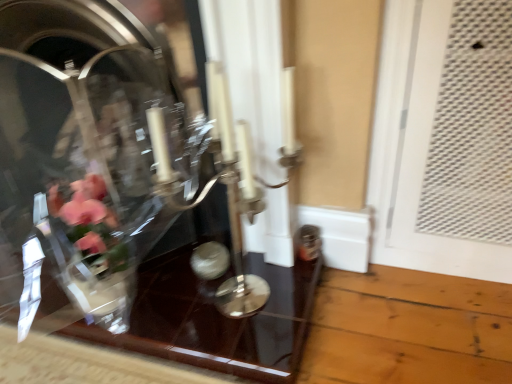
Image resolution: width=512 pixels, height=384 pixels. Describe the element at coordinates (216, 320) in the screenshot. I see `transparent glass table at center` at that location.

Where is `transparent glass table at center`? Image resolution: width=512 pixels, height=384 pixels. transparent glass table at center is located at coordinates (216, 320).

From the image's perspective, is silver metallic candle holder at center located above or below transparent glass table at center?

silver metallic candle holder at center is above transparent glass table at center.

Is silver metallic candle holder at center shorter than transparent glass table at center?

In fact, silver metallic candle holder at center may be taller than transparent glass table at center.

Between silver metallic candle holder at center and transparent glass table at center, which one has larger size?

silver metallic candle holder at center.

Considering the relative positions of silver metallic candle holder at center and transparent glass table at center in the image provided, is silver metallic candle holder at center to the left or to the right of transparent glass table at center?

From the image, it's evident that silver metallic candle holder at center is to the right of transparent glass table at center.

Between silver metallic candle holder at center and clear glass vase at center, which one is positioned behind?

clear glass vase at center is further away from the camera.

Can you tell me how much silver metallic candle holder at center and clear glass vase at center differ in facing direction?

There is a 6.97-degree angle between the facing directions of silver metallic candle holder at center and clear glass vase at center.

From a real-world perspective, is silver metallic candle holder at center on clear glass vase at center?

No, from a real-world perspective, silver metallic candle holder at center is not on top of clear glass vase at center.

Considering the sizes of objects silver metallic candle holder at center and clear glass vase at center in the image provided, who is shorter, silver metallic candle holder at center or clear glass vase at center?

Standing shorter between the two is silver metallic candle holder at center.

Who is bigger, transparent glass table at center or silver metallic candle holder at center?

silver metallic candle holder at center.

Is transparent glass table at center inside the boundaries of silver metallic candle holder at center, or outside?

transparent glass table at center is not enclosed by silver metallic candle holder at center.

Is there a large distance between transparent glass table at center and silver metallic candle holder at center?

That's not correct — transparent glass table at center is a little close to silver metallic candle holder at center.

Does transparent glass table at center turn towards clear glass vase at center?

No, transparent glass table at center is not aimed at clear glass vase at center.

This screenshot has height=384, width=512. In order to click on glass table located on the right of clear glass vase at center in this screenshot , I will do `click(216, 320)`.

Consider the image. Is clear glass vase at center inside transparent glass table at center?

Actually, clear glass vase at center is outside transparent glass table at center.

Is transparent glass table at center positioned far away from clear glass vase at center?

That's not correct — transparent glass table at center is a little close to clear glass vase at center.

Is clear glass vase at center not near transparent glass table at center?

No, clear glass vase at center is not far from transparent glass table at center.

The height and width of the screenshot is (384, 512). I want to click on glass box that is in front of the transparent glass table at center, so click(121, 201).

Does point (52, 46) come farther from viewer compared to point (196, 349)?

That is True.

Who is shorter, clear glass vase at center or transparent glass table at center?

transparent glass table at center.

Consider the image. Is the depth of clear glass vase at center greater than that of silver metallic candle holder at center?

Yes, it is.

Looking at this image, from the image's perspective, does clear glass vase at center appear lower than silver metallic candle holder at center?

No, from the image's perspective, clear glass vase at center is not beneath silver metallic candle holder at center.

The height and width of the screenshot is (384, 512). I want to click on glass table on the left of silver metallic candle holder at center, so click(216, 320).

Where is `candle holder in front of the clear glass vase at center`? The width and height of the screenshot is (512, 384). candle holder in front of the clear glass vase at center is located at coordinates (226, 191).

Considering their positions, is silver metallic candle holder at center positioned closer to transparent glass table at center than clear glass vase at center?

clear glass vase at center is closer to transparent glass table at center.

Estimate the real-world distances between objects in this image. Which object is closer to clear glass vase at center, silver metallic candle holder at center or transparent glass table at center?

transparent glass table at center is closer to clear glass vase at center.

From the image, which object appears to be nearer to transparent glass table at center, clear glass vase at center or silver metallic candle holder at center?

The object closer to transparent glass table at center is clear glass vase at center.

Looking at the image, which one is located further to silver metallic candle holder at center, transparent glass table at center or clear glass vase at center?

Among the two, transparent glass table at center is located further to silver metallic candle holder at center.

When comparing their distances from silver metallic candle holder at center, does clear glass vase at center or transparent glass table at center seem closer?

Among the two, clear glass vase at center is located nearer to silver metallic candle holder at center.

Considering their positions, is transparent glass table at center positioned closer to clear glass vase at center than silver metallic candle holder at center?

transparent glass table at center lies closer to clear glass vase at center than the other object.

This screenshot has width=512, height=384. In order to click on glass table between clear glass vase at center and silver metallic candle holder at center in the horizontal direction in this screenshot , I will do `click(216, 320)`.